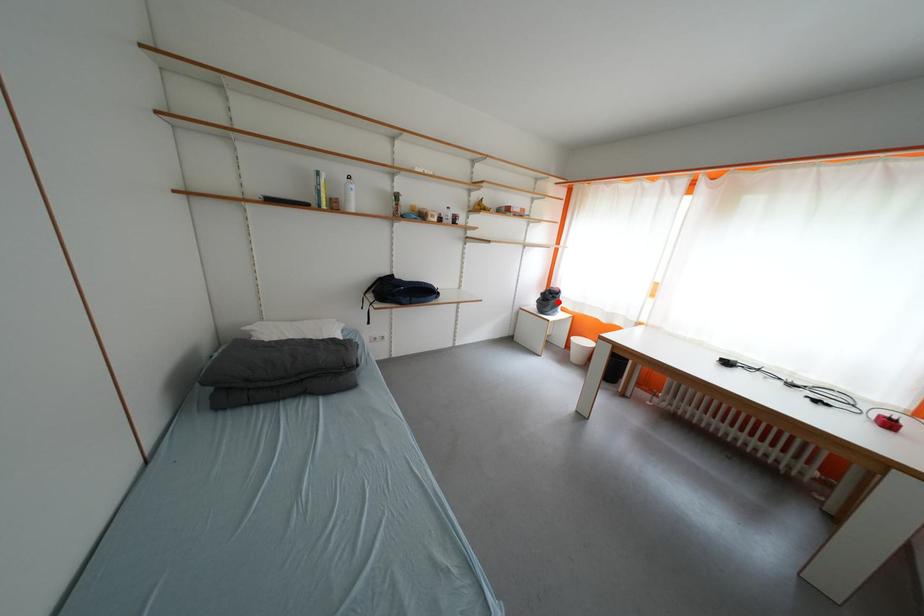
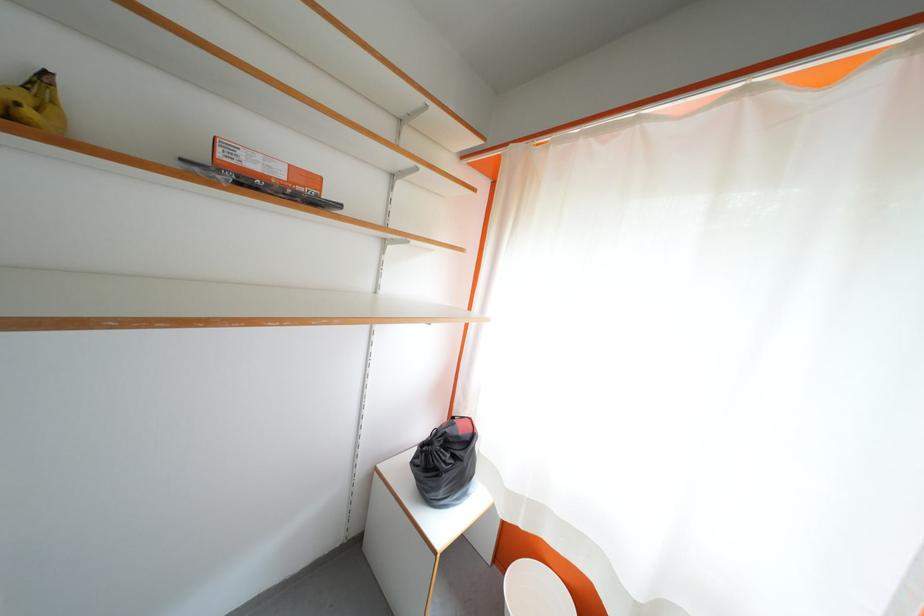
Locate, in the second image, the point that corresponds to the highlighted location in the first image.

(455, 460)